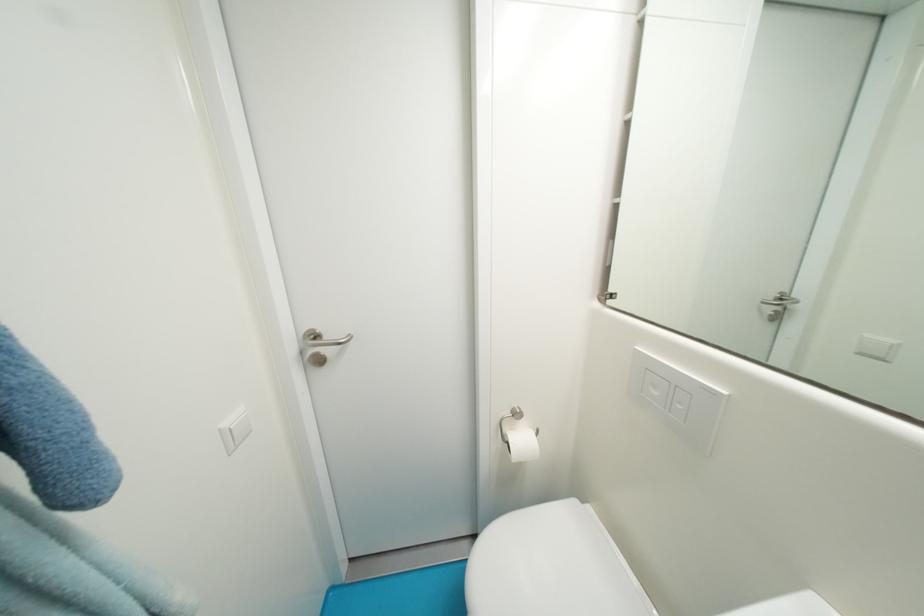
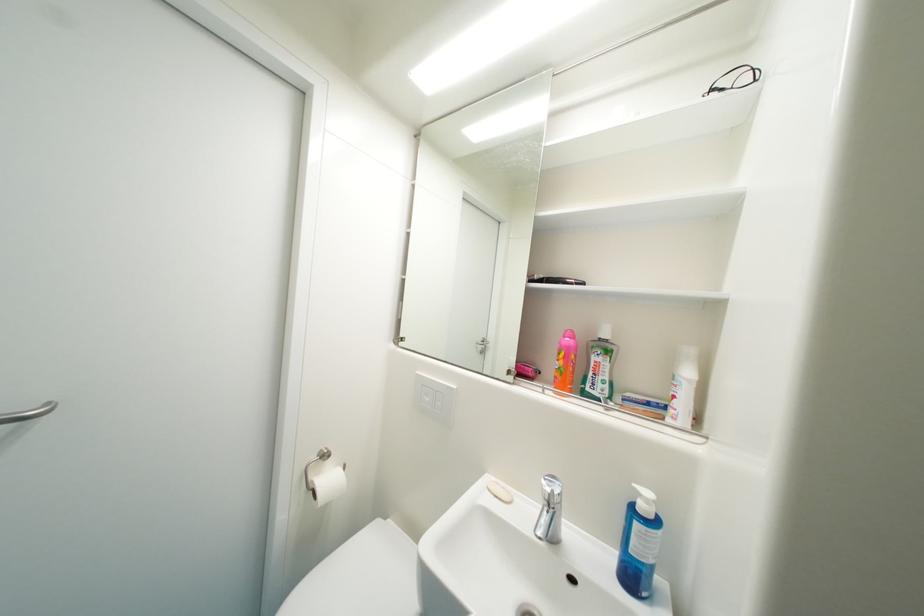
Locate, in the second image, the point that corresponds to (529,442) in the first image.

(337, 482)